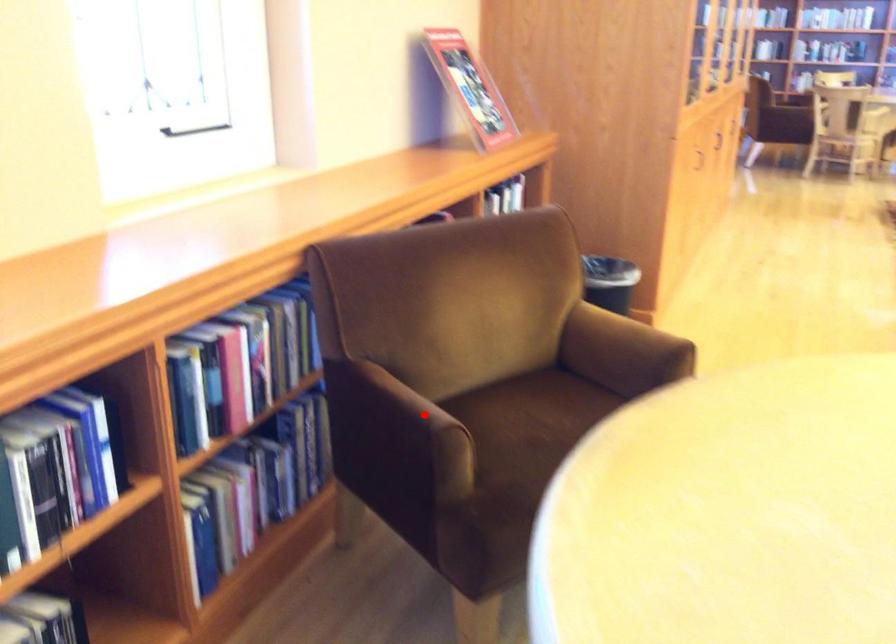
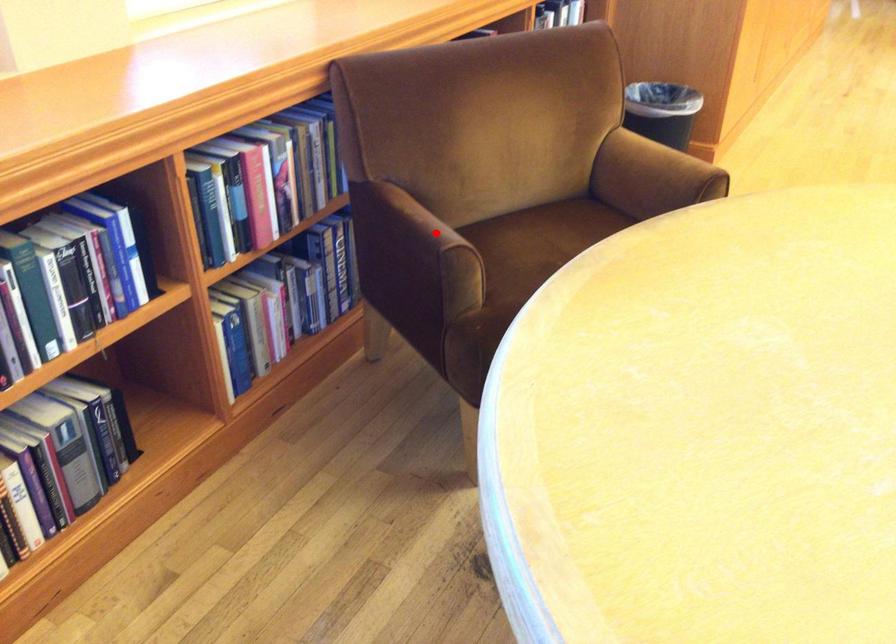
I am providing you with two images of the same scene from different viewpoints. A red point is marked on the first image and another point is marked on the second image. Do the highlighted points in image1 and image2 indicate the same real-world spot?

Yes